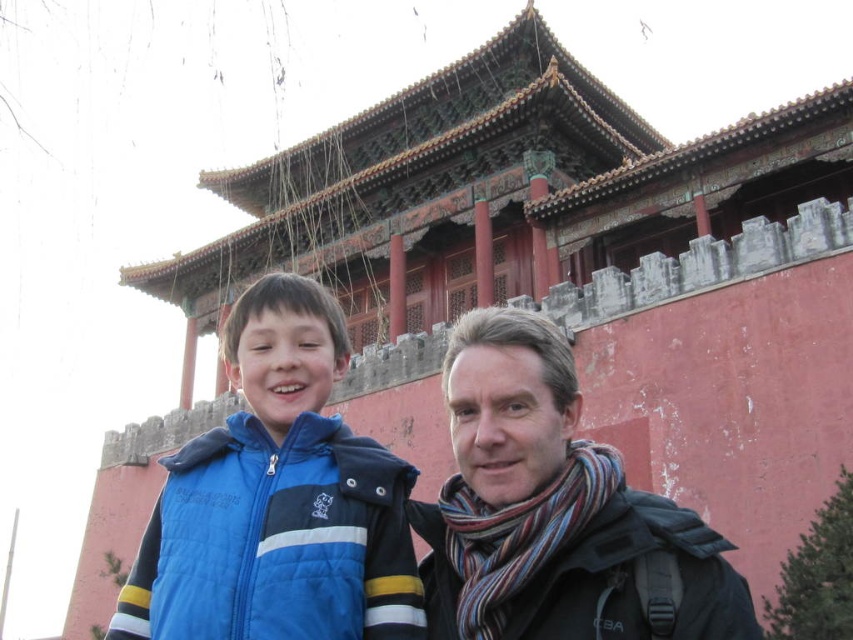
Based on the photo, who is more forward, (281,276) or (538,520)?

Positioned in front is point (538,520).

Can you confirm if blue quilted jacket at center is wider than striped scarf at center?

No, blue quilted jacket at center is not wider than striped scarf at center.

Is point (363, 612) closer to camera compared to point (606, 627)?

That is False.

You are a GUI agent. You are given a task and a screenshot of the screen. Output one action in this format:
    pyautogui.click(x=<x>, y=<y>)
    Task: Click on the blue quilted jacket at center
    
    Given the screenshot: What is the action you would take?
    pyautogui.click(x=277, y=500)